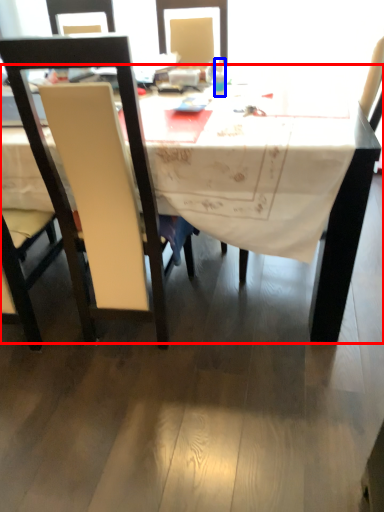
Question: Which of the following is the closest to the observer, desk (highlighted by a red box) or bottle (highlighted by a blue box)?

Choices:
 (A) desk
 (B) bottle

Answer: (A)